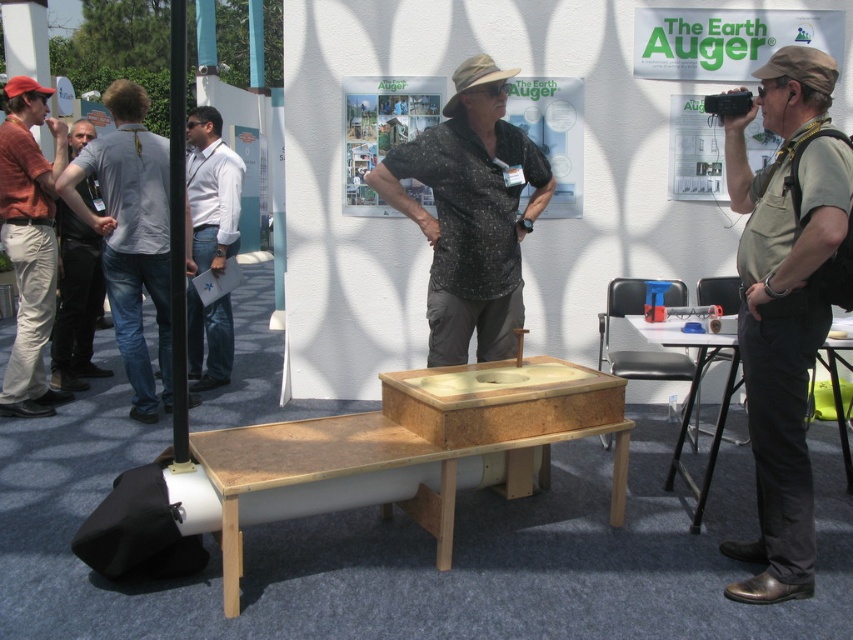
You are a photographer at the exhibition and want to capture a clear photo of the white shirt at center without the khaki fabric shirt at center blocking it. What should you do?

The khaki fabric shirt at center is in front of the white shirt at center, so you should move the khaki fabric shirt at center out of the way to ensure the white shirt at center is visible in the photo.

You are standing at the entrance of the exhibition hall and see two points marked in the image. The first point is at coordinate point (827, 310) and the second is at point (206, 262). Which point is closer to you?

Point (827, 310) is in front of point (206, 262), so it is closer to you.